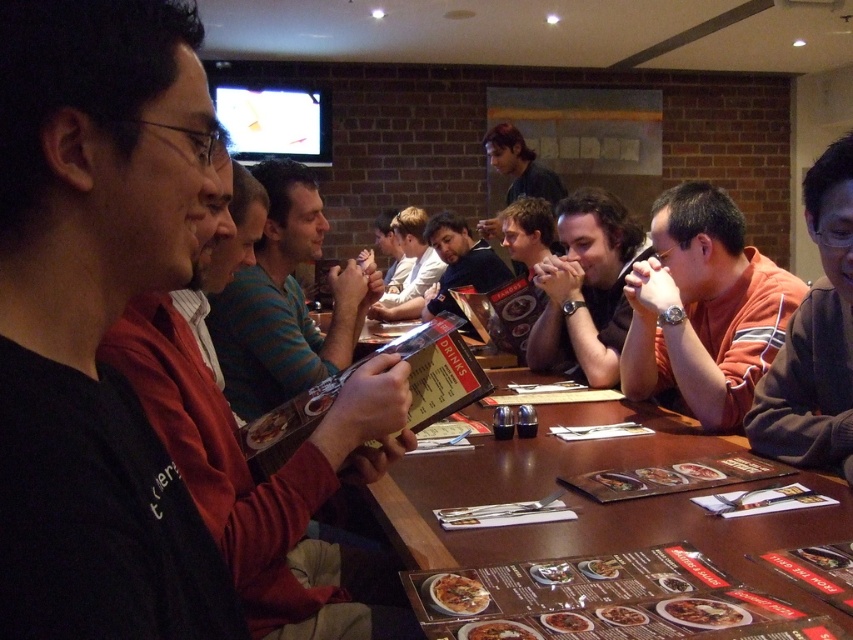
Based on the photo, you are a server at a restaurant who needs to deliver a drink to a customer wearing the orange striped shirt at center. You are currently standing next to the black matte shirt at center. The tray you are holding is 1.5 meters wide. Can you safely walk between the two customers without spilling the drink?

The black matte shirt at center and orange striped shirt at center are 1.48 meters apart. Since the tray is 1.5 meters wide, it is wider than the space between them. Therefore, you cannot safely walk between the two customers without risking the tray hitting them or spilling the drink.

You are a photographer trying to capture a group photo of the people at the table. You notice two individuals wearing a black matte shirt at center and an orange striped shirt at center. Which person should you position closer to the camera to ensure their entire torso is visible in the photo?

The black matte shirt at center should be positioned closer to the camera because it is shorter than the orange striped shirt at center, so moving them forward ensures their entire torso is visible.